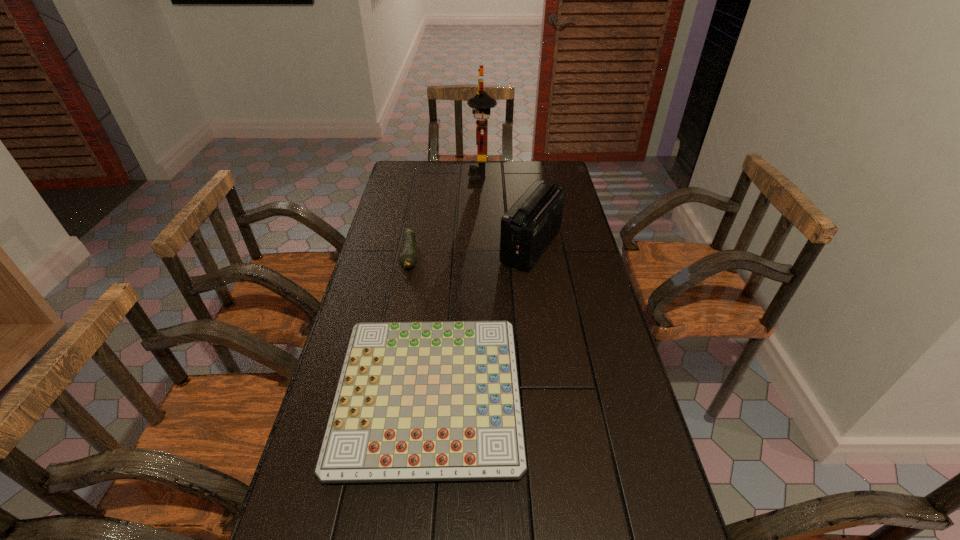
Image resolution: width=960 pixels, height=540 pixels. Identify the location of the farthest object. (482, 102).

Locate an element on the screen. This screenshot has height=540, width=960. the tallest object is located at coordinates (482, 102).

You are a GUI agent. You are given a task and a screenshot of the screen. Output one action in this format:
    pyautogui.click(x=<x>, y=<y>)
    Task: Click on the radio receiver
    Image resolution: width=960 pixels, height=540 pixels.
    Given the screenshot: What is the action you would take?
    pyautogui.click(x=528, y=227)

Find the location of `zucchini`. zucchini is located at coordinates (407, 260).

At what (x,y) coordinates should I click in order to perform the action: click on the nearest object. Please return your answer as a coordinate pair (x, y). Looking at the image, I should click on pos(416,401).

You are a GUI agent. You are given a task and a screenshot of the screen. Output one action in this format:
    pyautogui.click(x=<x>, y=<y>)
    Task: Click on the free space located on the front-facing side of the nutcracker
    The image size is (960, 540).
    Given the screenshot: What is the action you would take?
    pyautogui.click(x=418, y=177)

In order to click on free location located 0.180m on the front-facing side of the nutcracker in this screenshot , I will do `click(428, 177)`.

Image resolution: width=960 pixels, height=540 pixels. What are the coordinates of `vacant space positioned 0.050m on the front-facing side of the nutcracker` in the screenshot? It's located at (458, 177).

Locate an element on the screen. Image resolution: width=960 pixels, height=540 pixels. vacant space situated 0.380m on the front panel of the third shortest object is located at coordinates (393, 246).

Find the location of a particular element. The width and height of the screenshot is (960, 540). free spot located 0.150m on the front panel of the third shortest object is located at coordinates (457, 246).